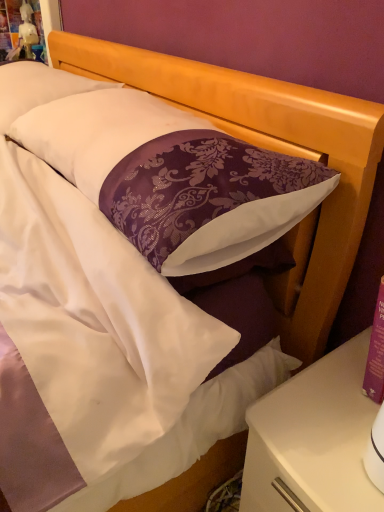
Locate an element on the screen. The height and width of the screenshot is (512, 384). free space above white glossy nightstand at lower right (from a real-world perspective) is located at coordinates (333, 415).